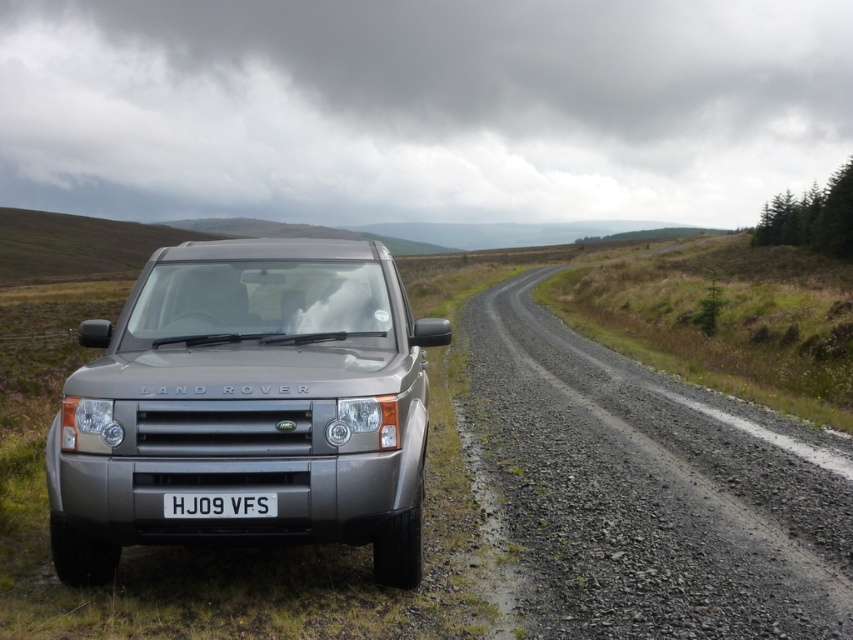
Question: Considering the relative positions of gravel road at center and white plastic license plate at center in the image provided, where is gravel road at center located with respect to white plastic license plate at center?

Choices:
 (A) right
 (B) left

Answer: (A)

Question: Does gravel road at center lie in front of white plastic license plate at center?

Choices:
 (A) no
 (B) yes

Answer: (A)

Question: Estimate the real-world distances between objects in this image. Which object is closer to the white plastic license plate at center?

Choices:
 (A) satin silver land rover at center
 (B) gravel road at center

Answer: (A)

Question: Does satin silver land rover at center have a smaller size compared to gravel road at center?

Choices:
 (A) yes
 (B) no

Answer: (A)

Question: Which object is the farthest from the white plastic license plate at center?

Choices:
 (A) satin silver land rover at center
 (B) gravel road at center

Answer: (B)

Question: Among these objects, which one is farthest from the camera?

Choices:
 (A) satin silver land rover at center
 (B) white plastic license plate at center

Answer: (A)